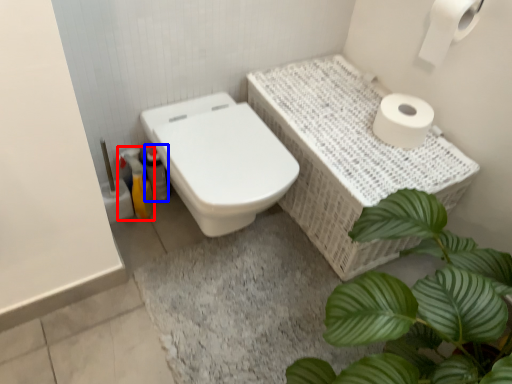
Question: Which of the following is the farthest to the observer, cleaning product (highlighted by a red box) or bottle (highlighted by a blue box)?

Choices:
 (A) cleaning product
 (B) bottle

Answer: (B)